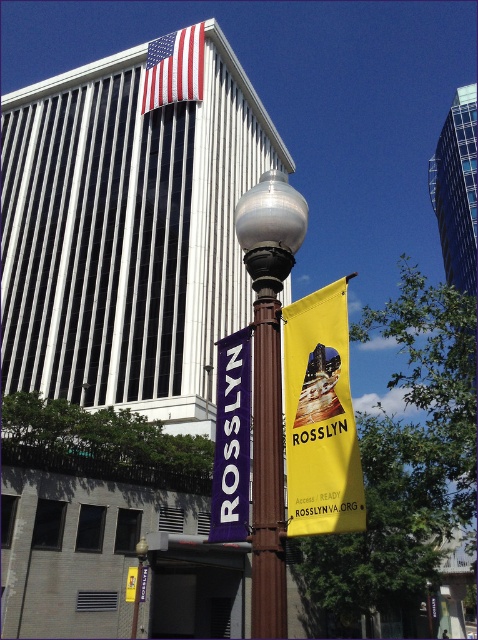
Does polished brass street light at center appear over american flag at upper center?

No.

Is polished brass street light at center to the left of american flag at upper center from the viewer's perspective?

Incorrect, polished brass street light at center is not on the left side of american flag at upper center.

Find the location of a particular element. polished brass street light at center is located at coordinates (269, 381).

Locate an element on the screen. The height and width of the screenshot is (640, 478). polished brass street light at center is located at coordinates (269, 381).

Where is `purple fabric banner at center`? purple fabric banner at center is located at coordinates (231, 440).

Is purple fabric banner at center to the right of american flag at upper center from the viewer's perspective?

Indeed, purple fabric banner at center is positioned on the right side of american flag at upper center.

Describe the element at coordinates (231, 440) in the screenshot. This screenshot has width=478, height=640. I see `purple fabric banner at center` at that location.

Find the location of a particular element. This screenshot has height=640, width=478. purple fabric banner at center is located at coordinates pyautogui.click(x=231, y=440).

Can you confirm if yellow fabric banner at center is shorter than american flag at upper center?

Yes, yellow fabric banner at center is shorter than american flag at upper center.

What are the coordinates of `yellow fabric banner at center` in the screenshot? It's located at (321, 417).